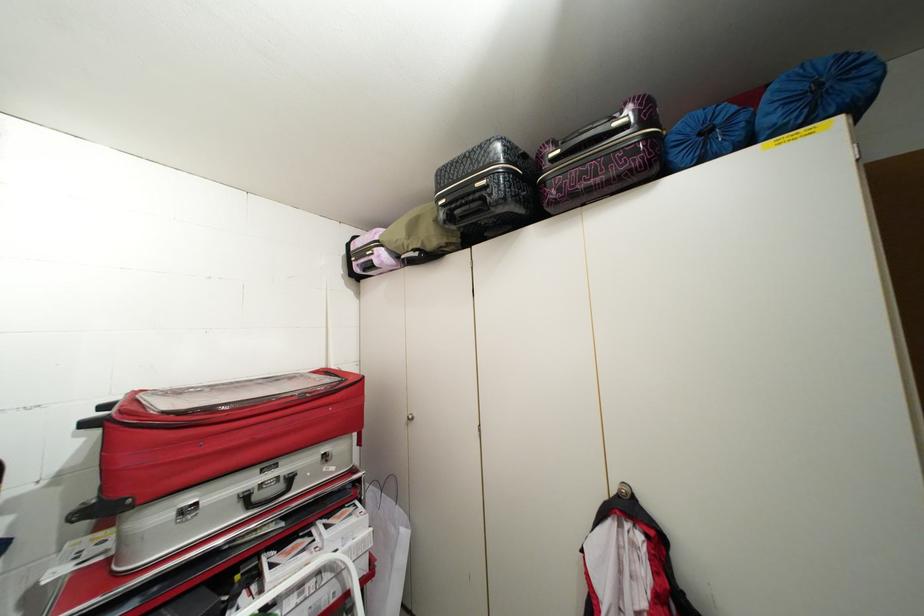
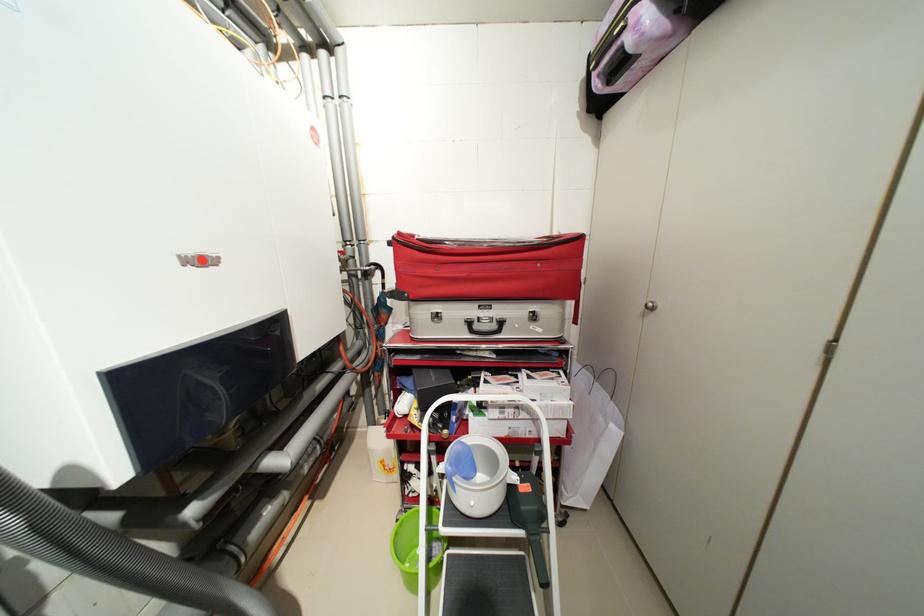
The point at (346, 575) is marked in the first image. Where is the corresponding point in the second image?

(541, 421)